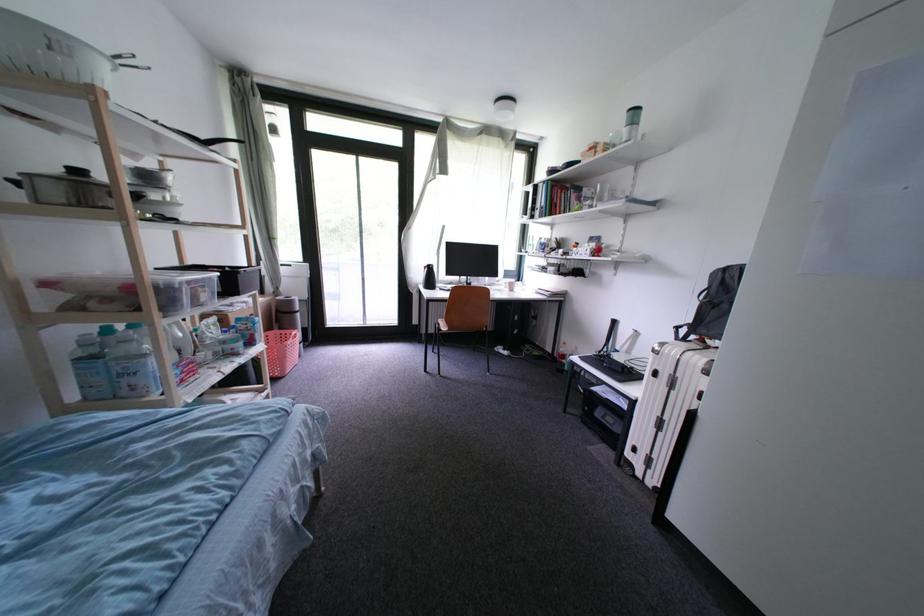
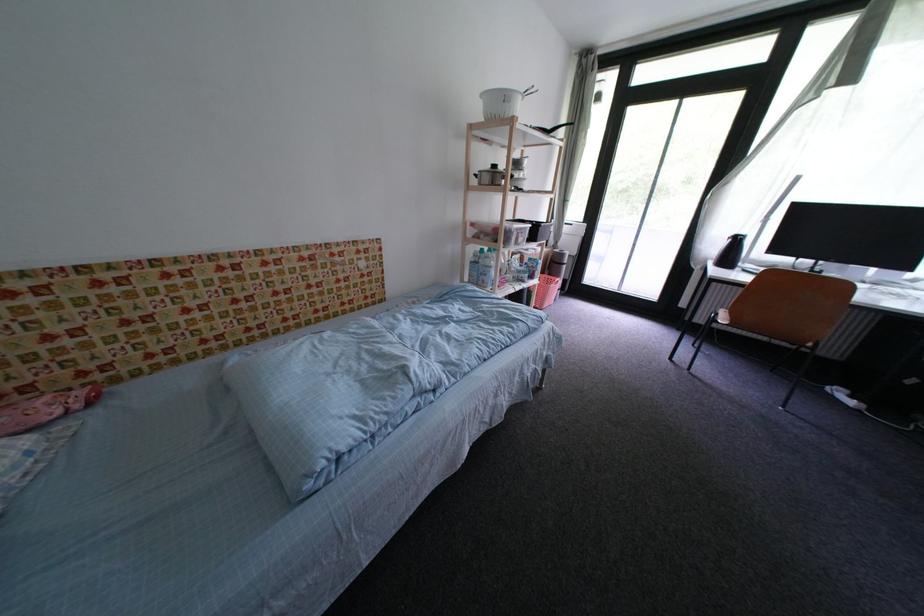
Find the pixel in the second image that matches (86,174) in the first image.

(503, 169)